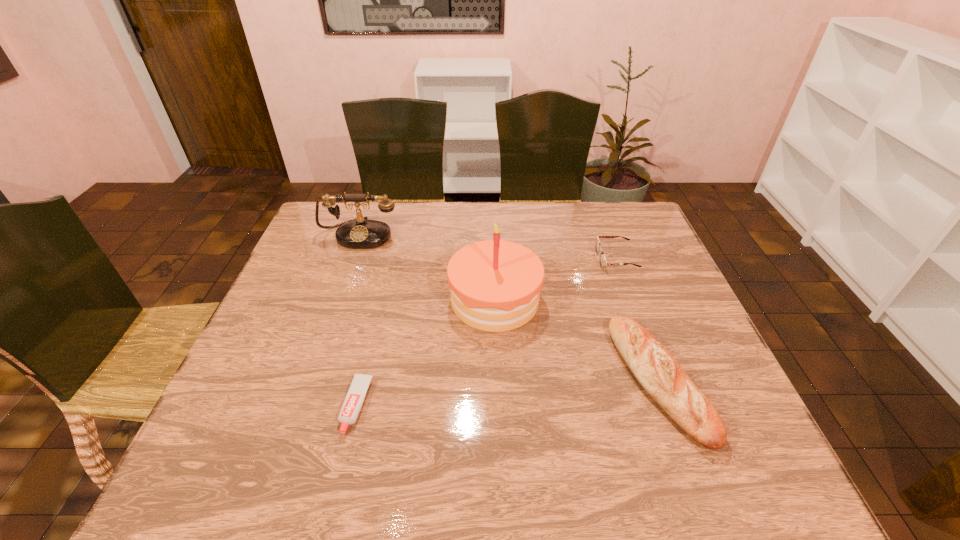
The height and width of the screenshot is (540, 960). I want to click on vacant point located between the toothpaste and the spectacles, so click(x=486, y=332).

Where is `blank region between the fourth shortest object and the third object from left to right`? The width and height of the screenshot is (960, 540). blank region between the fourth shortest object and the third object from left to right is located at coordinates (427, 267).

Locate an element on the screen. This screenshot has height=540, width=960. the fourth closest object to the fourth tallest object is located at coordinates (355, 397).

The width and height of the screenshot is (960, 540). I want to click on object that is the third closest to the toothpaste, so click(659, 373).

The height and width of the screenshot is (540, 960). I want to click on free point that satisfies the following two spatial constraints: 1. on the dial of the shortest object; 2. on the left side of the second tallest object, so click(300, 406).

Where is `free space that satisfies the following two spatial constraints: 1. on the dial of the telephone; 2. on the right side of the tallest object`? Image resolution: width=960 pixels, height=540 pixels. free space that satisfies the following two spatial constraints: 1. on the dial of the telephone; 2. on the right side of the tallest object is located at coordinates (337, 300).

Identify the location of free space in the image that satisfies the following two spatial constraints: 1. on the back side of the birthday cake; 2. on the left side of the shortest object. (382, 300).

This screenshot has height=540, width=960. What are the coordinates of `free point that satisfies the following two spatial constraints: 1. on the frame of the fourth tallest object; 2. on the front side of the birthday cake` in the screenshot? It's located at (631, 300).

Where is `free space that satisfies the following two spatial constraints: 1. on the dial of the baguet; 2. on the right side of the telephone`? The height and width of the screenshot is (540, 960). free space that satisfies the following two spatial constraints: 1. on the dial of the baguet; 2. on the right side of the telephone is located at coordinates (308, 381).